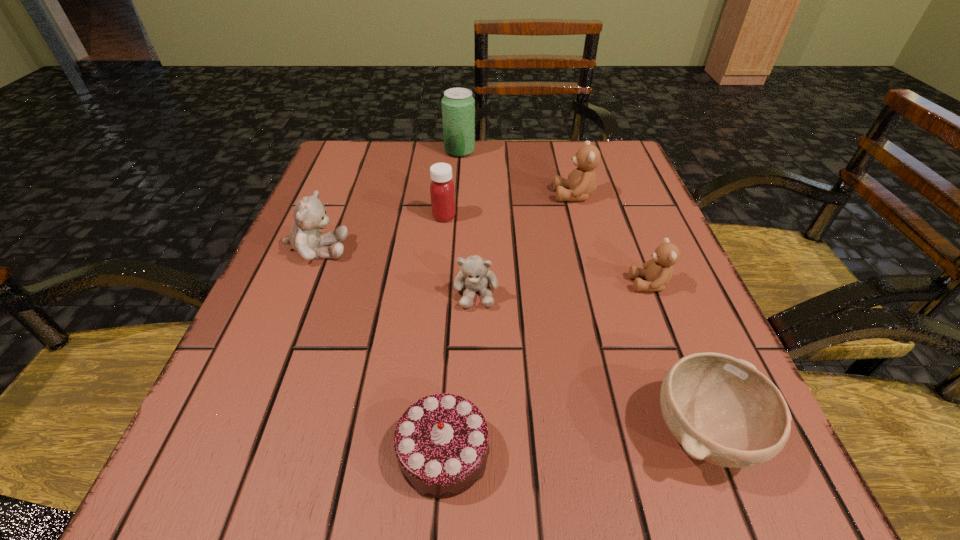
At what (x,y) coordinates should I click in order to perform the action: click on vacant region at the near left corner of the desktop. Please return your answer as a coordinate pair (x, y). The width and height of the screenshot is (960, 540). Looking at the image, I should click on (208, 456).

Where is `vacant area between the bigger brown teddy bear and the chocolate chocolate cake`? Image resolution: width=960 pixels, height=540 pixels. vacant area between the bigger brown teddy bear and the chocolate chocolate cake is located at coordinates click(x=509, y=324).

You are a GUI agent. You are given a task and a screenshot of the screen. Output one action in this format:
    pyautogui.click(x=<x>, y=<y>)
    Task: Click on the vacant space in between the third teddy bear from left to right and the chocolate chocolate cake
    This screenshot has height=540, width=960.
    Given the screenshot: What is the action you would take?
    pyautogui.click(x=509, y=324)

This screenshot has width=960, height=540. Identify the location of unoccupied area between the smaller gray teddy bear and the bowl. (590, 363).

I want to click on vacant area between the medicine and the rightmost teddy bear, so click(547, 250).

What are the coordinates of `free spot between the shortest object and the soda` in the screenshot? It's located at (452, 302).

Where is `empty space that is in between the beige bowl and the right gray teddy bear`? empty space that is in between the beige bowl and the right gray teddy bear is located at coordinates (590, 363).

This screenshot has height=540, width=960. In order to click on blank region between the second farthest teddy bear and the chocolate chocolate cake in this screenshot , I will do `click(381, 351)`.

The height and width of the screenshot is (540, 960). Identify the location of vacant point located between the farthest object and the farther brown teddy bear. (516, 173).

Find the location of a particular element. free space between the chocolate cake and the left gray teddy bear is located at coordinates [381, 351].